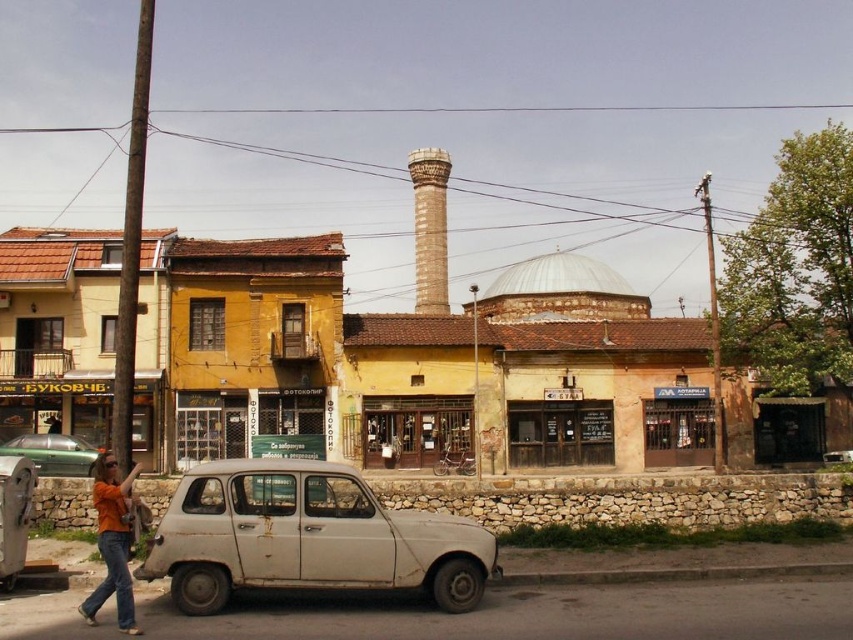
Which is in front, point (90, 381) or point (833, 451)?

Point (90, 381) is in front.

In the scene shown: Who is lower down, yellow painted building at center or white matte car at center?

white matte car at center is below.

Where is `yellow painted building at center`? yellow painted building at center is located at coordinates (410, 364).

Consider the image. Who is positioned more to the right, brown stone minaret at center or white matte car at center?

white matte car at center

Does brown stone minaret at center have a greater width compared to white matte car at center?

Correct, the width of brown stone minaret at center exceeds that of white matte car at center.

Who is more forward, (x=434, y=301) or (x=825, y=454)?

Positioned in front is point (x=825, y=454).

At what (x,y) coordinates should I click in order to perform the action: click on brown stone minaret at center. Please return your answer as a coordinate pair (x, y). Image resolution: width=853 pixels, height=640 pixels. Looking at the image, I should click on (428, 228).

Which is above, rusty white car at center or brown stone minaret at center?

Positioned higher is brown stone minaret at center.

Which is in front, point (444, 604) or point (440, 307)?

Point (444, 604) is in front.

Who is more forward, (212, 525) or (425, 176)?

Point (212, 525) is more forward.

Locate an element on the screen. rusty white car at center is located at coordinates (306, 538).